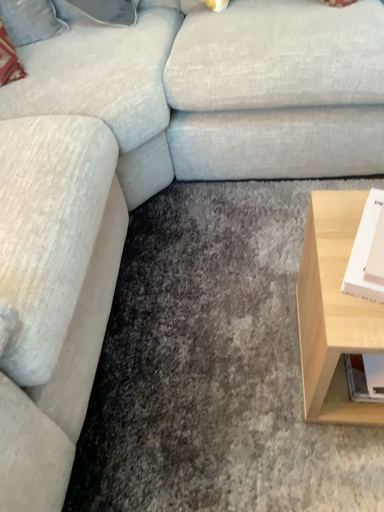
This screenshot has height=512, width=384. Identify the location of white matte book at right. (364, 251).

What do you see at coordinates (364, 251) in the screenshot? I see `white matte book at right` at bounding box center [364, 251].

This screenshot has height=512, width=384. What are the coordinates of `white matte book at right` in the screenshot? It's located at (364, 251).